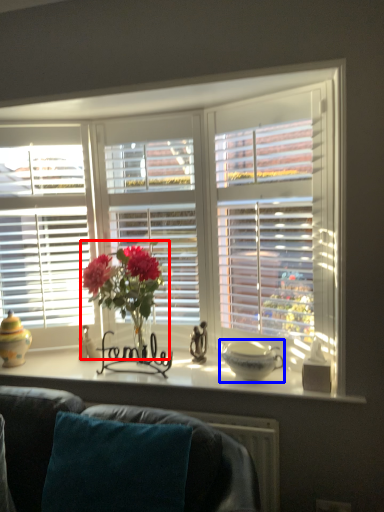
Question: Which object is closer to the camera taking this photo, floral arrangement (highlighted by a red box) or glass bowl (highlighted by a blue box)?

Choices:
 (A) floral arrangement
 (B) glass bowl

Answer: (A)